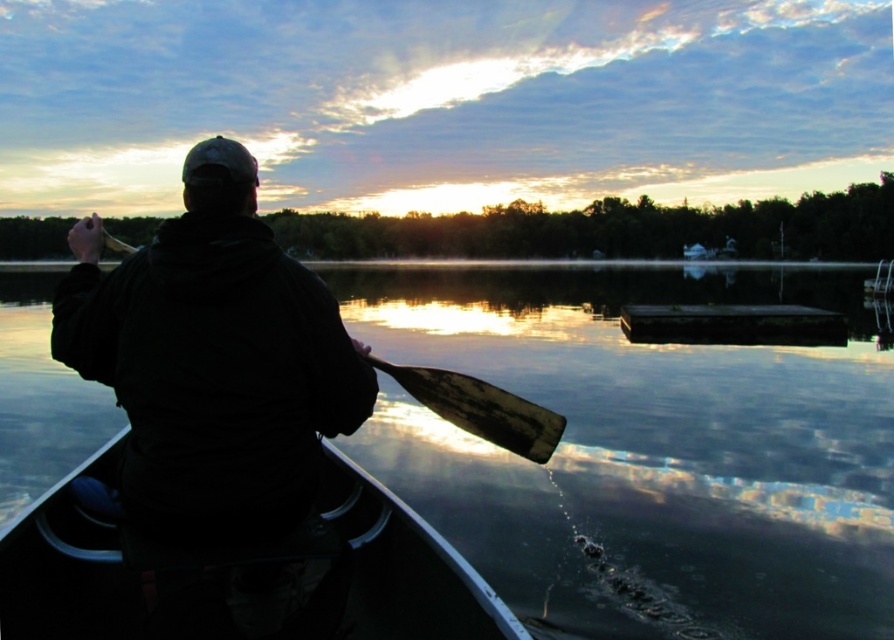
You are a drone operator trying to capture the canoe in the image. The drone is currently at coordinates 0.5, 0.5. What direction should you move the drone to get closer to the black plastic canoe at lower left?

The black plastic canoe at lower left is located at coordinates (243, 573). Since the drone is at (447, 320), you should move the drone downward and to the right to reach the canoe.

You are a photographer planning to capture the reflection of the smooth water at center and the wooden at left in the image. Which object should you focus on first if you want to photograph the reflection first before the other?

The smooth water at center should be focused on first because it is positioned on the left side of wooden at left, meaning it is closer to the left where the reflection is more prominent.

You are planning to cross the lake in a small boat that requires at least 10 meters of width to navigate safely. Based on the scene, can you determine if the smooth water at center has enough width compared to the wooden at left?

The smooth water at center might be wider than wooden at left, so it could potentially provide enough width for the boat. However, without exact measurements, it is uncertain if it meets the 10 meters requirement.